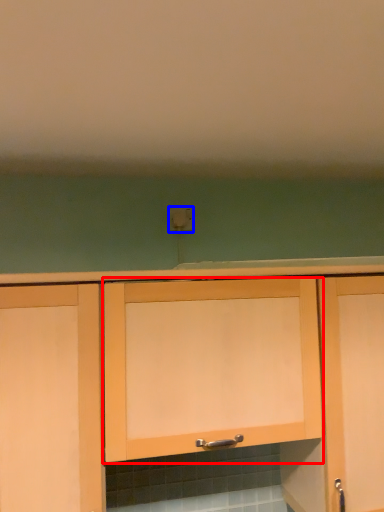
Question: Which of the following is the closest to the observer, cabinetry (highlighted by a red box) or electric outlet (highlighted by a blue box)?

Choices:
 (A) cabinetry
 (B) electric outlet

Answer: (A)